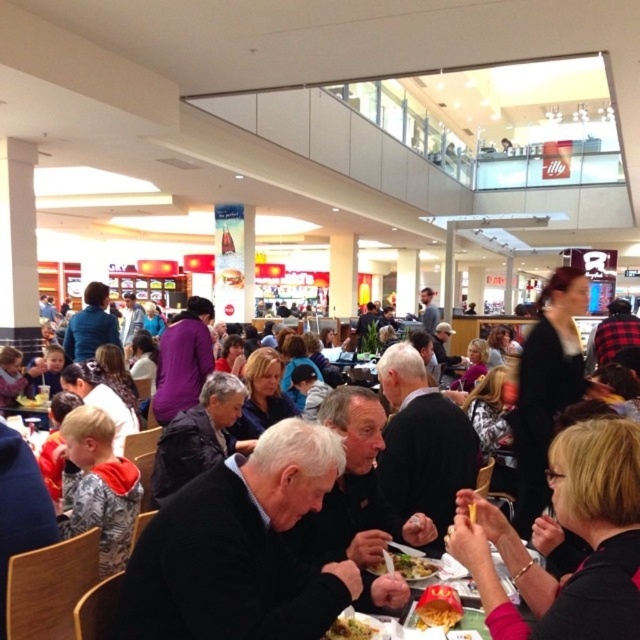
Question: Does golden crispy fries at lower center come behind white glossy plate at center?

Choices:
 (A) no
 (B) yes

Answer: (A)

Question: Can you confirm if dark gray sweater at center is positioned to the right of golden crispy fries at center?

Choices:
 (A) no
 (B) yes

Answer: (A)

Question: Which point is farther from the camera taking this photo?

Choices:
 (A) (604, 577)
 (B) (353, 634)
 (C) (618, 445)

Answer: (B)

Question: Does dark gray sweater at center lie behind golden crispy fries at center?

Choices:
 (A) no
 (B) yes

Answer: (A)

Question: Estimate the real-world distances between objects in this image. Which object is farther from the golden crispy fries at center?

Choices:
 (A) black textured sweater at lower right
 (B) white glossy plate at center

Answer: (A)

Question: Which point is farther from the camera taking this photo?

Choices:
 (A) (588, 492)
 (B) (605, 630)
 (C) (348, 612)

Answer: (C)